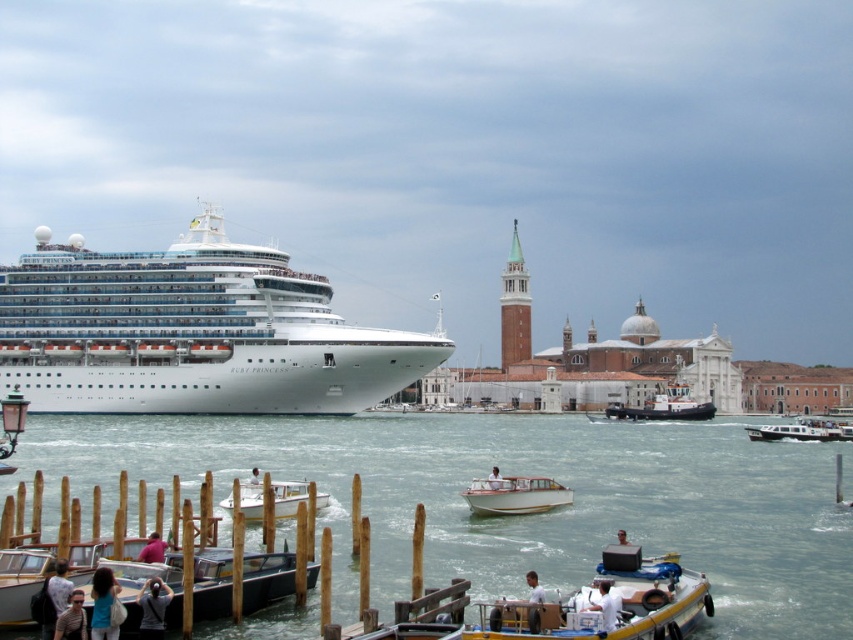
You are a photographer standing at the water edge in the Venice port scene. You want to capture a photo of the cruise ship Ruby Princess docked on the left. There is a specific point at coordinates point (221, 564) that you need to include in your shot. Given that the distance from your camera to this point is 155.34 feet, can you estimate whether this point is closer to the cruise ship or the smaller boats in the foreground?

The point at (221, 564) is 155.34 feet away from the camera. Since the cruise ship Ruby Princess is docked on the left side of the frame and the smaller boats are in the foreground, the point is likely closer to the cruise ship as it is farther back compared to the foreground boats.